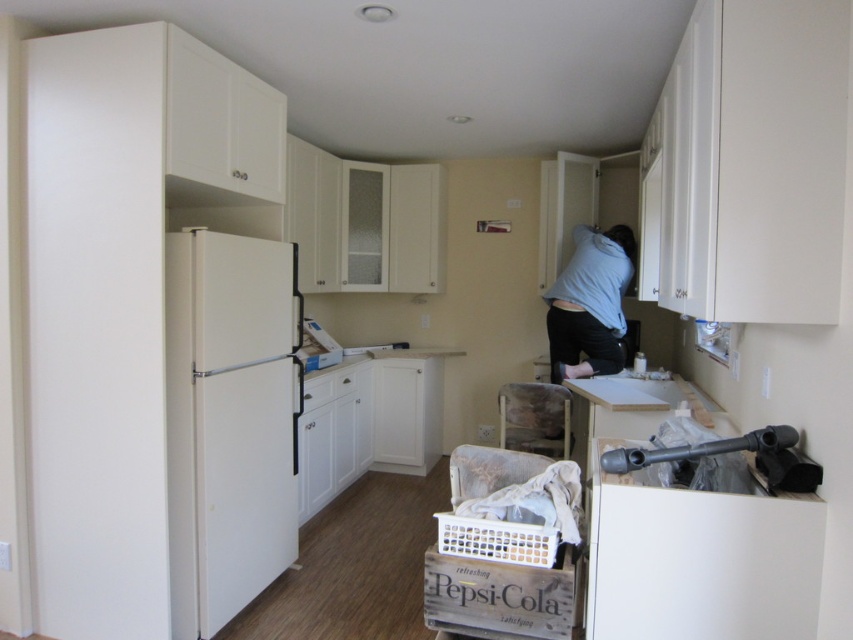
You are organizing the kitchen and need to place the blue cotton shirt at upper center into the white matte refrigerator at left. Is there enough space for the shirt in the refrigerator?

The white matte refrigerator at left is thinner than the blue cotton shirt at upper center, so the shirt may not fit inside the refrigerator due to the refrigerator being narrower in width.

Consider the image. You are a delivery person who just arrived to drop off a package. You see the white matte refrigerator at left and the blue cotton shirt at upper center. If you need to place the package between them, will there be enough space?

The white matte refrigerator at left and blue cotton shirt at upper center are 5.78 feet apart, so placing the package between them should be possible as the distance is sufficient.